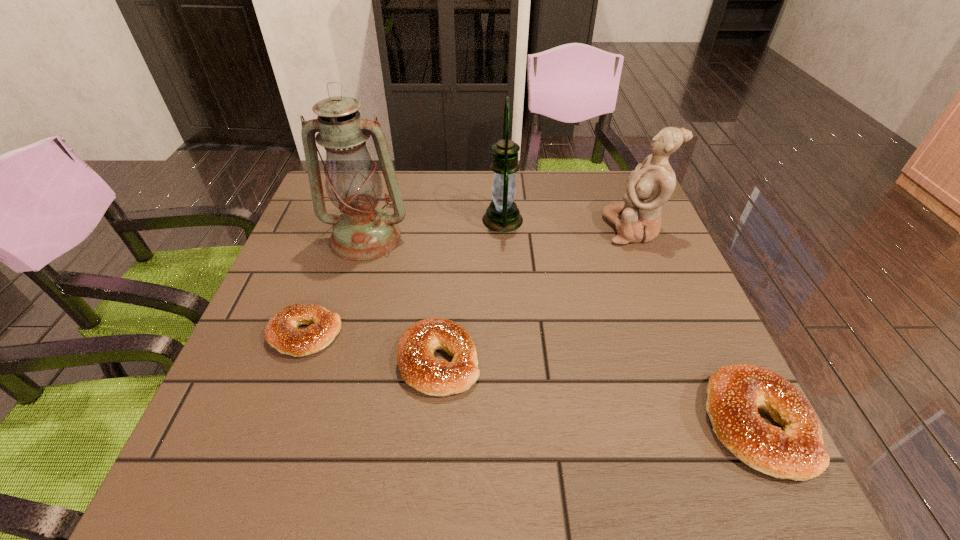
Please mark a free spot for a new bagel to balance the arrangement. Please provide its 2D coordinates. Your answer should be formatted as a tuple, i.e. [(x, y)], where the tuple contains the x and y coordinates of a point satisfying the conditions above.

[(588, 390)]